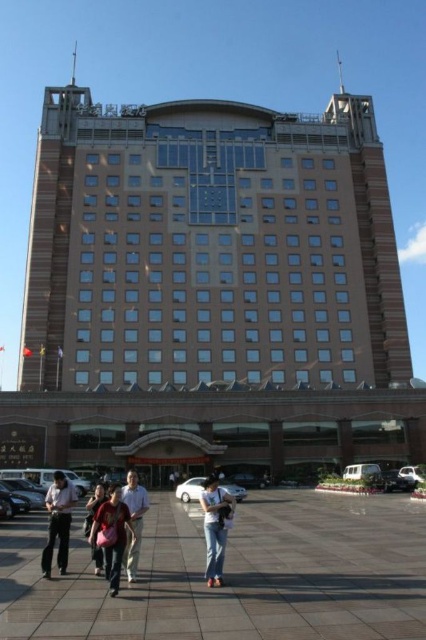
Question: Among these points, which one is nearest to the camera?

Choices:
 (A) (132, 509)
 (B) (152, 118)
 (C) (374, 577)

Answer: (C)

Question: Among these points, which one is farthest from the camera?

Choices:
 (A) (104, 516)
 (B) (166, 104)

Answer: (B)

Question: Is denim jeans at center positioned in front of light brown leather jacket at lower center?

Choices:
 (A) no
 (B) yes

Answer: (B)

Question: Does brown brick building at center appear on the left side of matte pink jacket at center?

Choices:
 (A) no
 (B) yes

Answer: (A)

Question: Does brown brick building at center have a larger size compared to brown tile pavement at lower center?

Choices:
 (A) yes
 (B) no

Answer: (A)

Question: Which of the following is the closest to the observer?

Choices:
 (A) light brown leather jacket at lower center
 (B) matte pink jacket at center
 (C) brown tile pavement at lower center
 (D) denim jeans at center

Answer: (C)